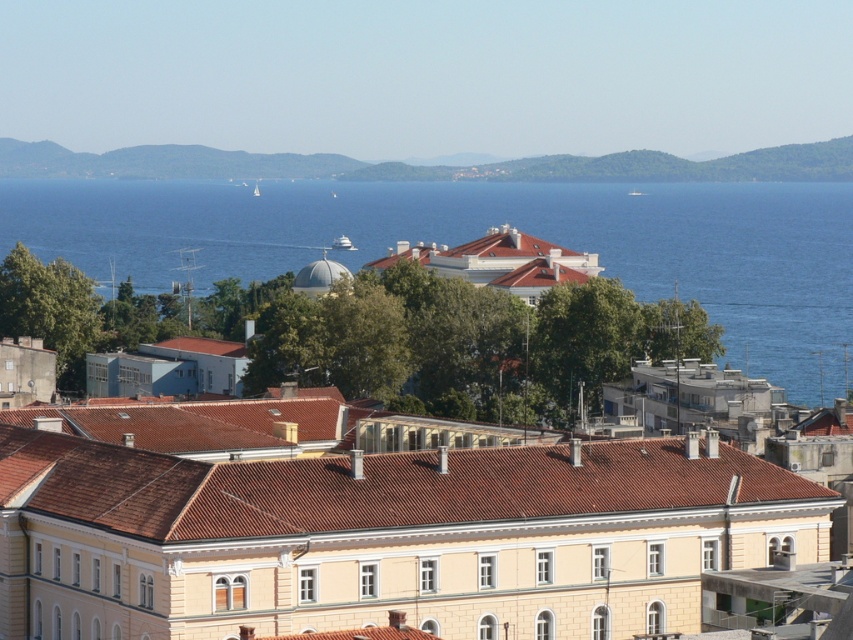
Question: Among these objects, which one is nearest to the camera?

Choices:
 (A) blue water at center
 (B) beige stone building at center

Answer: (B)

Question: Which object appears closest to the camera in this image?

Choices:
 (A) beige stone building at center
 (B) blue water at center

Answer: (A)

Question: Can you confirm if beige stone building at center is positioned to the left of blue water at center?

Choices:
 (A) yes
 (B) no

Answer: (A)

Question: Can you confirm if beige stone building at center is positioned above blue water at center?

Choices:
 (A) no
 (B) yes

Answer: (A)

Question: Does beige stone building at center appear on the left side of blue water at center?

Choices:
 (A) no
 (B) yes

Answer: (B)

Question: Which object appears closest to the camera in this image?

Choices:
 (A) beige stone building at center
 (B) blue water at center

Answer: (A)